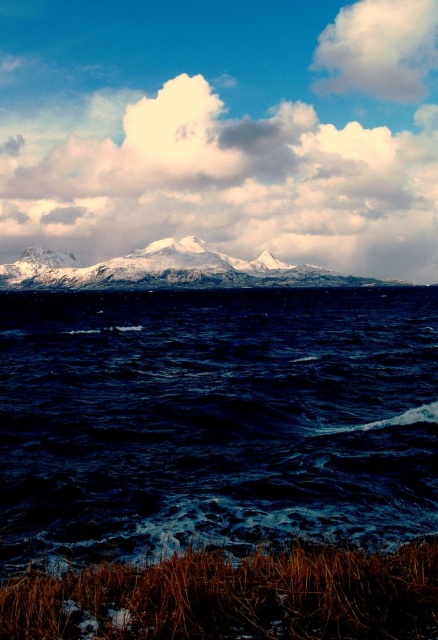
Question: Where is brown grass at lower center located in relation to snowy rock mountain at upper center in the image?

Choices:
 (A) left
 (B) right

Answer: (B)

Question: Which point is farther from the camera taking this photo?

Choices:
 (A) (87, 512)
 (B) (183, 284)
 (C) (410, 29)
 (D) (149, 605)

Answer: (C)

Question: Which of the following is the closest to the observer?

Choices:
 (A) (261, 556)
 (B) (363, 449)
 (C) (350, 40)

Answer: (A)

Question: Which of the following is the closest to the observer?

Choices:
 (A) (236, 252)
 (B) (394, 54)
 (C) (20, 604)

Answer: (C)

Question: Can you confirm if snowy rock mountain at upper center is positioned to the right of white fluffy cloud at upper right?

Choices:
 (A) yes
 (B) no

Answer: (B)

Question: Can you confirm if dark blue water at center is positioned to the left of snowy rock mountain at upper center?

Choices:
 (A) yes
 (B) no

Answer: (B)